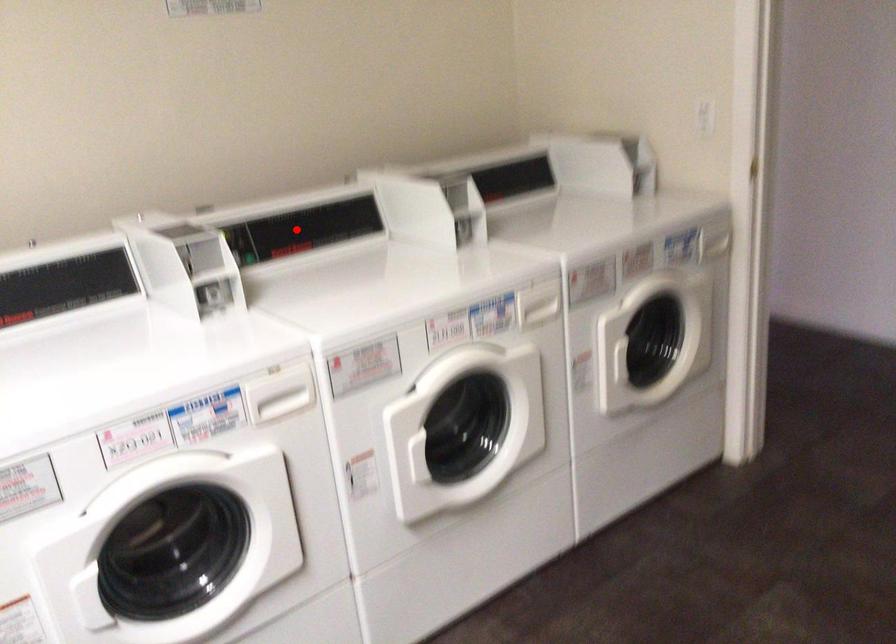
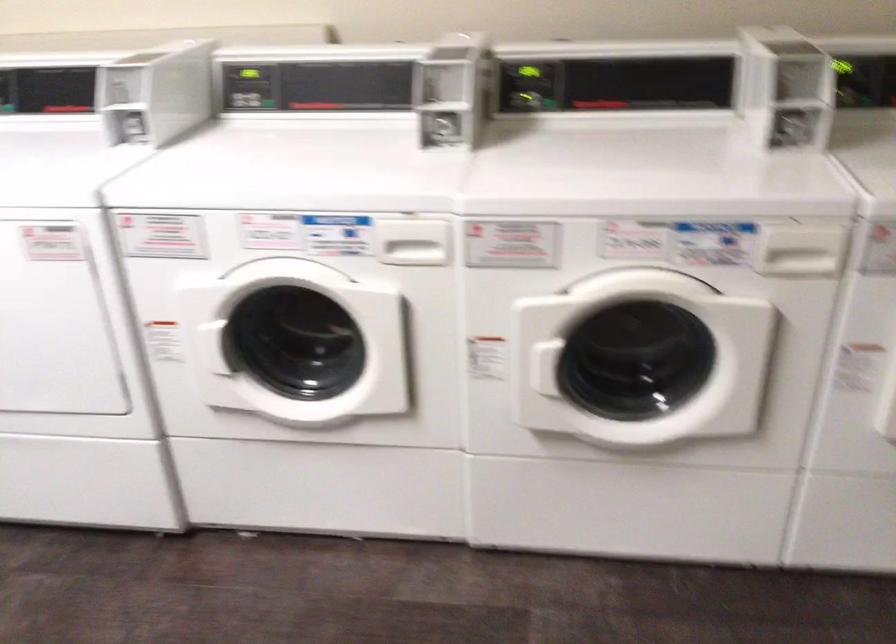
Question: A red point is marked in image1. In image2, is the corresponding 3D point closer to the camera or farther? Reply with the corresponding letter.

Choices:
 (A) The corresponding 3D point is closer.
 (B) The corresponding 3D point is farther.

Answer: (A)